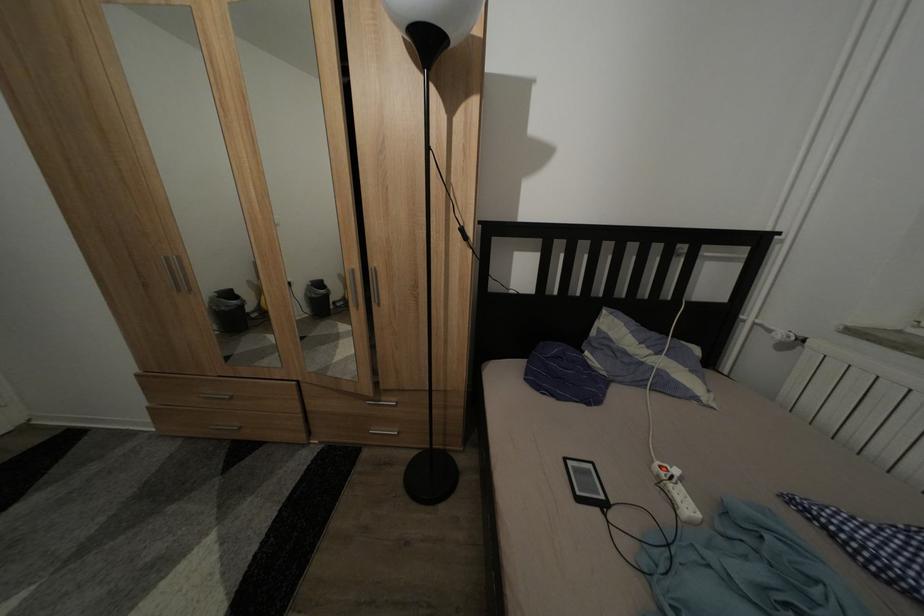
The height and width of the screenshot is (616, 924). I want to click on metal drawer handle, so click(215, 395).